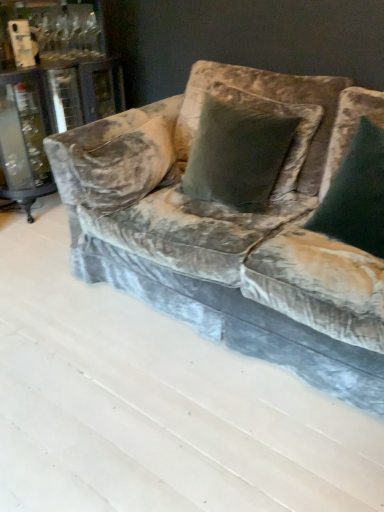
Question: From their relative heights in the image, would you say velvet green pillow at center, the second pillow positioned from the right, is taller or shorter than velvet couch at center?

Choices:
 (A) short
 (B) tall

Answer: (B)

Question: In terms of size, does velvet green pillow at center, the second pillow positioned from the right, appear bigger or smaller than velvet couch at center?

Choices:
 (A) big
 (B) small

Answer: (B)

Question: Considering the real-world distances, which object is farthest from the dark green velvet pillow at center, which is counted as the first pillow, starting from the right?

Choices:
 (A) velvet green pillow at center, which is the first pillow in left-to-right order
 (B) velvet couch at center

Answer: (B)

Question: Considering the real-world distances, which object is closest to the velvet green pillow at center, the second pillow positioned from the right?

Choices:
 (A) dark green velvet pillow at center, which appears as the second pillow when viewed from the left
 (B) velvet couch at center

Answer: (B)